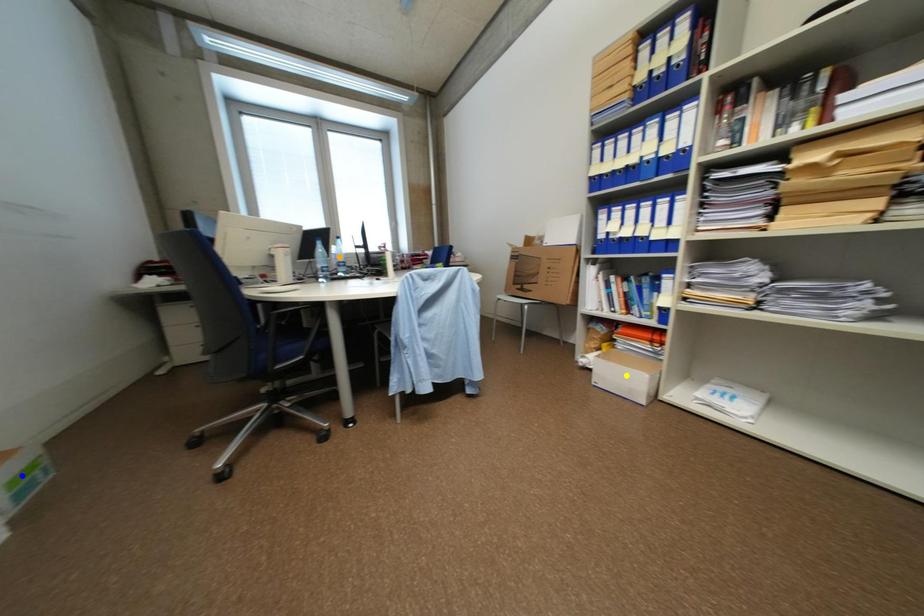
Looking at this image, order these from farthest to nearest:
blue point | yellow point | orange point

1. orange point
2. yellow point
3. blue point